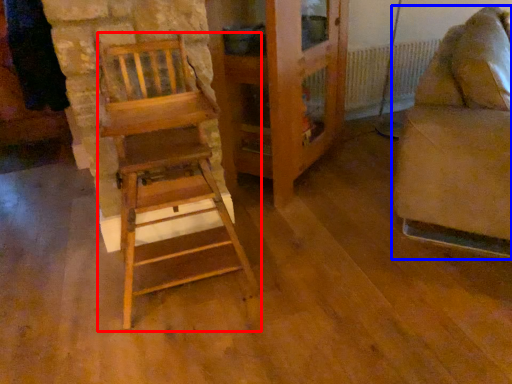
Question: Which point is closer to the camera, furniture (highlighted by a red box) or furniture (highlighted by a blue box)?

Choices:
 (A) furniture
 (B) furniture

Answer: (A)